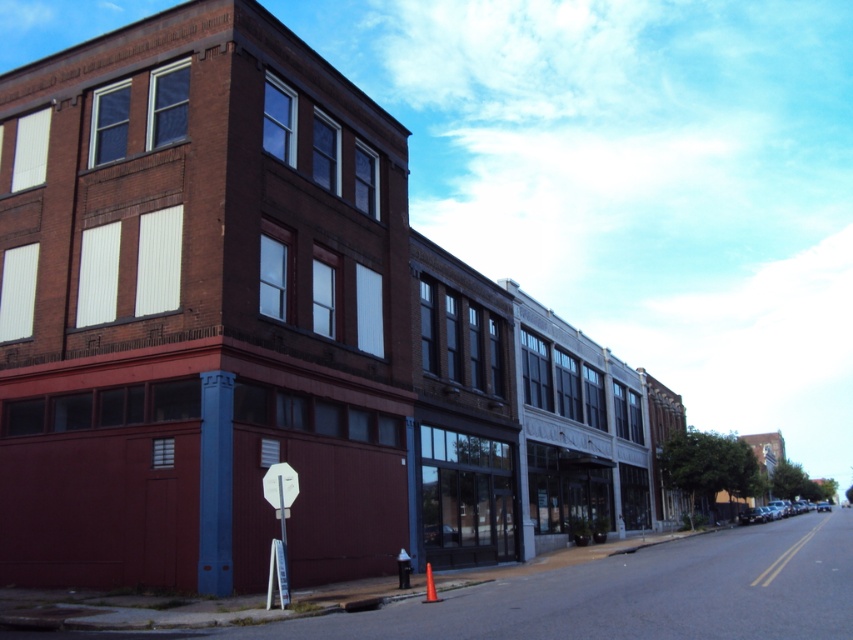
Question: Where is white plastic stop sign at center located in relation to metallic pole at center in the image?

Choices:
 (A) above
 (B) below

Answer: (B)

Question: Can you confirm if white plastic stop sign at center is smaller than metallic pole at center?

Choices:
 (A) no
 (B) yes

Answer: (A)

Question: Which object is farther from the camera taking this photo?

Choices:
 (A) white plastic stop sign at center
 (B) metallic pole at center

Answer: (B)

Question: Which point is closer to the camera taking this photo?

Choices:
 (A) (282, 588)
 (B) (279, 490)

Answer: (A)

Question: Which point appears closest to the camera in this image?

Choices:
 (A) (277, 481)
 (B) (283, 472)

Answer: (A)

Question: Does white plastic stop sign at center appear on the left side of metallic pole at center?

Choices:
 (A) no
 (B) yes

Answer: (B)